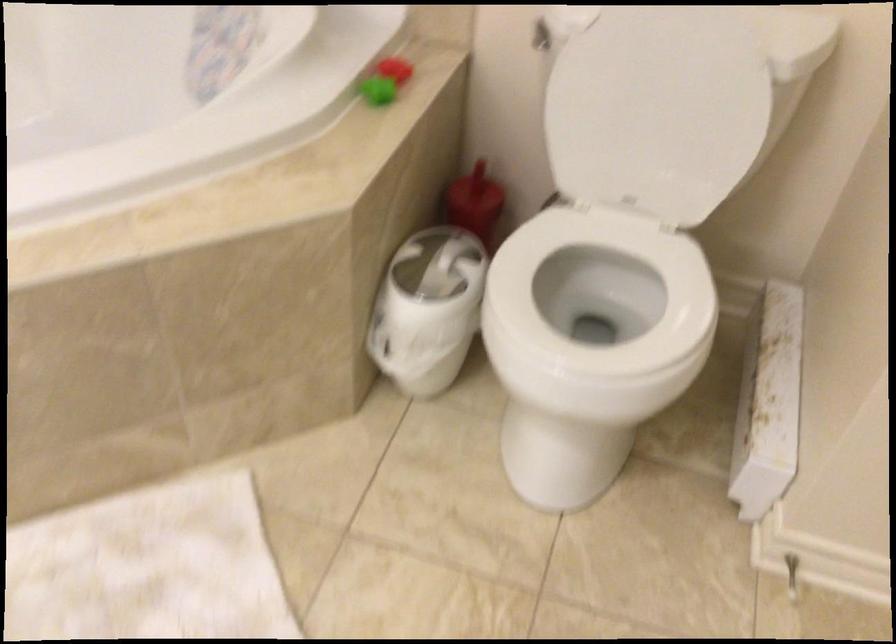
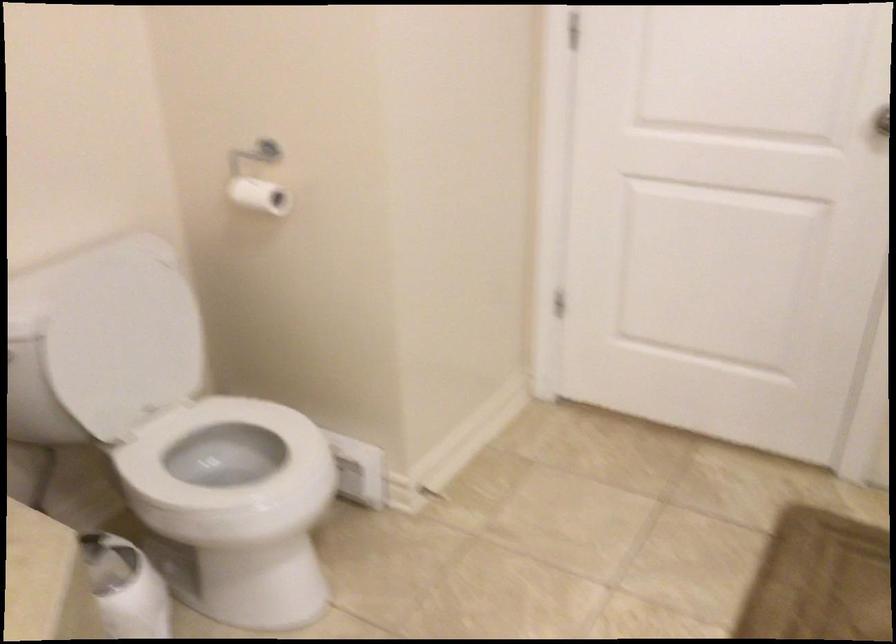
Question: The camera is either moving clockwise (left) or counter-clockwise (right) around the object. The first image is from the beginning of the video and the second image is from the end. Is the camera moving left or right when shooting the video?

Choices:
 (A) Left
 (B) Right

Answer: (A)